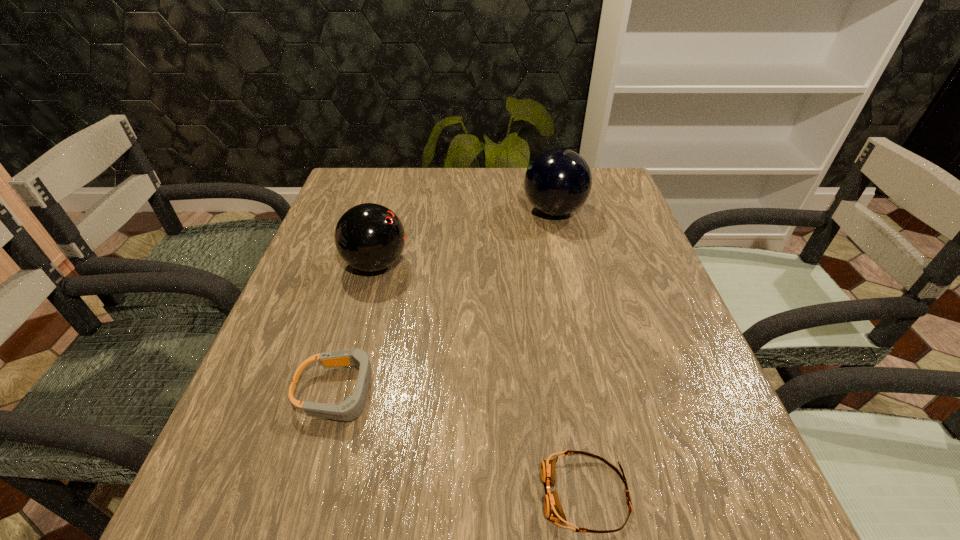
The image size is (960, 540). Find the location of `empty location between the left goggles and the nearer goggles`. empty location between the left goggles and the nearer goggles is located at coordinates (463, 443).

Where is `empty space between the nearer bowling ball and the left goggles`? empty space between the nearer bowling ball and the left goggles is located at coordinates (357, 328).

Locate an element on the screen. free space that is in between the nearer bowling ball and the farthest object is located at coordinates (465, 237).

You are a GUI agent. You are given a task and a screenshot of the screen. Output one action in this format:
    pyautogui.click(x=<x>, y=<y>)
    Task: Click on the empty space that is in between the left goggles and the nearer goggles
    
    Given the screenshot: What is the action you would take?
    pyautogui.click(x=463, y=443)

At what (x,y) coordinates should I click in order to perform the action: click on free space between the nearer bowling ball and the shortest object. Please return your answer as a coordinate pair (x, y). This screenshot has height=540, width=960. Looking at the image, I should click on (481, 379).

Identify the location of vacant space in between the second farthest object and the nearest object. (481, 379).

Locate an element on the screen. This screenshot has width=960, height=540. free space between the left goggles and the nearest object is located at coordinates (463, 443).

Locate an element on the screen. free space between the taller goggles and the farthest object is located at coordinates (446, 301).

The height and width of the screenshot is (540, 960). I want to click on free spot between the left goggles and the farther bowling ball, so click(x=446, y=301).

I want to click on free space between the shortest object and the second nearest object, so click(x=463, y=443).